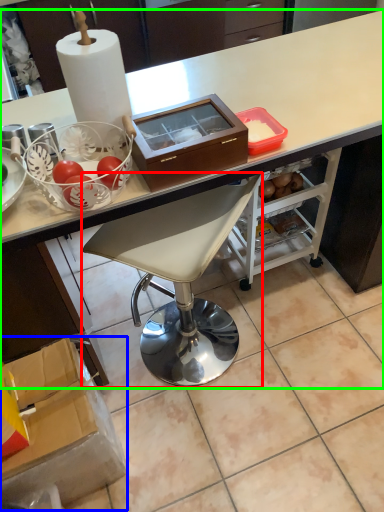
Question: Estimate the real-world distances between objects in this image. Which object is closer to chair (highlighted by a red box), box (highlighted by a blue box) or desk (highlighted by a green box)?

Choices:
 (A) box
 (B) desk

Answer: (A)